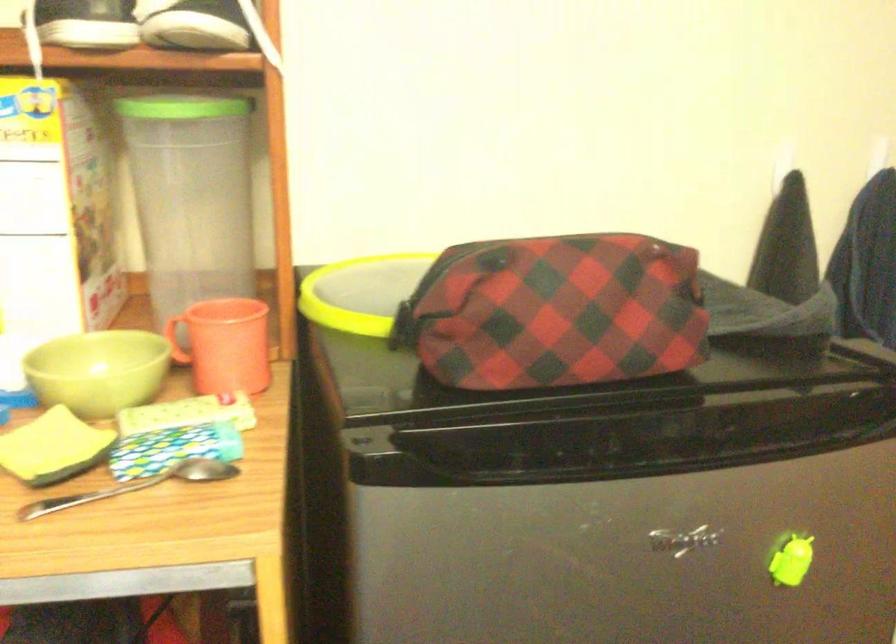
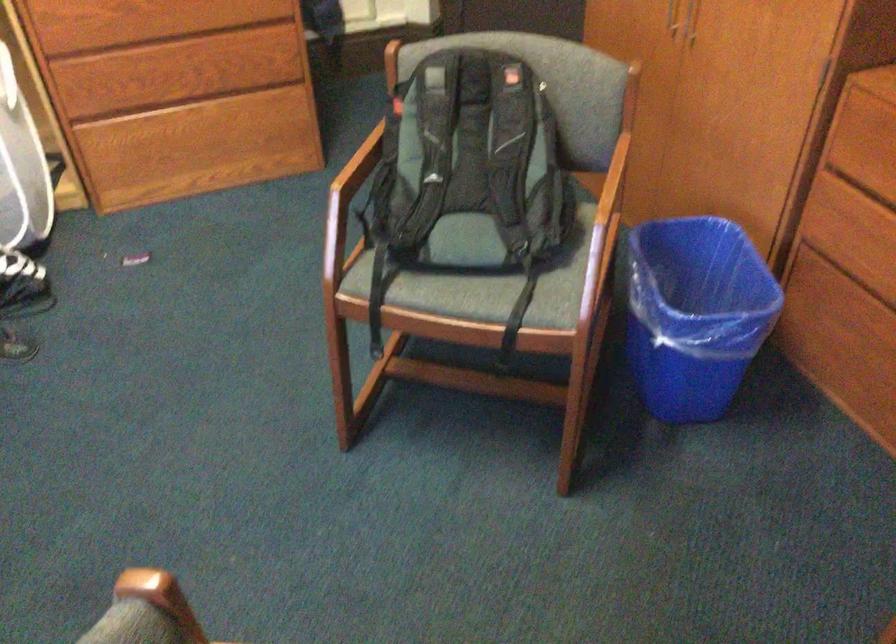
Which direction would the cameraman need to move to produce the second image?

The cameraman walked toward right, backward.